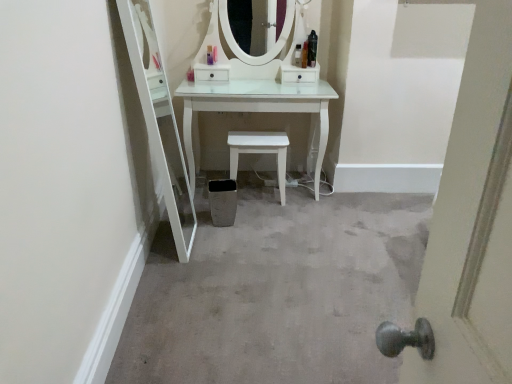
Where is `white glossy stool at center`? white glossy stool at center is located at coordinates (260, 152).

What do you see at coordinates (260, 152) in the screenshot?
I see `white glossy stool at center` at bounding box center [260, 152].

The width and height of the screenshot is (512, 384). In order to click on white glossy stool at center in this screenshot , I will do `click(260, 152)`.